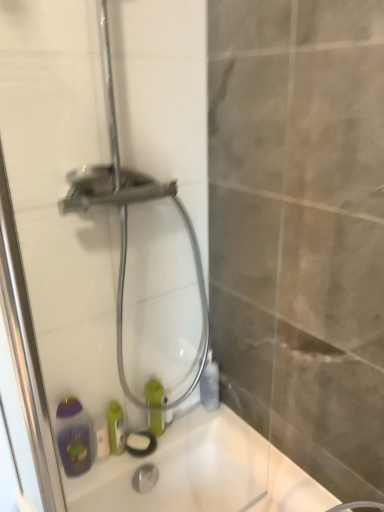
Find the location of `free space in front of matte gray bottle at right, the second bottle when ordered from left to right`. free space in front of matte gray bottle at right, the second bottle when ordered from left to right is located at coordinates (226, 428).